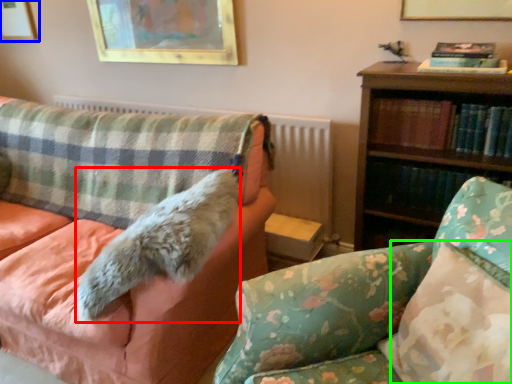
Question: Which object is the closest to the animal (highlighted by a red box)? Choose among these: picture frame (highlighted by a blue box) or pillow (highlighted by a green box).

Choices:
 (A) picture frame
 (B) pillow

Answer: (B)